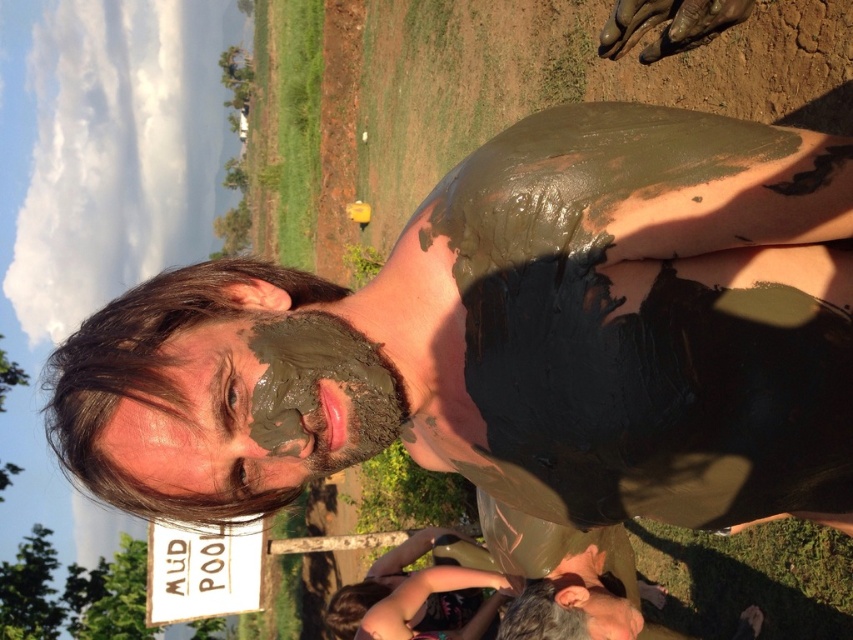
Question: Does matte mud face at center appear over muddy clay face at center?

Choices:
 (A) no
 (B) yes

Answer: (B)

Question: Which of the following is the farthest from the observer?

Choices:
 (A) (363, 369)
 (B) (192, 346)

Answer: (A)

Question: Is matte mud face at center below muddy clay face at center?

Choices:
 (A) yes
 (B) no

Answer: (B)

Question: Where is matte mud face at center located in relation to muddy clay face at center in the image?

Choices:
 (A) above
 (B) below

Answer: (A)